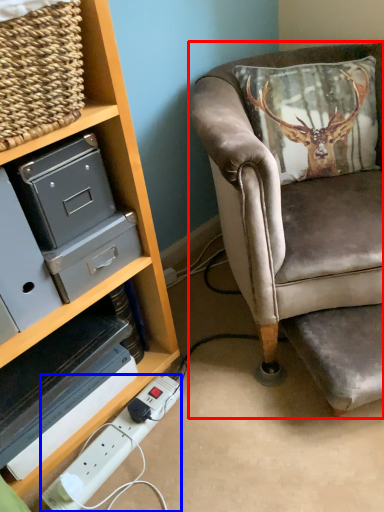
Question: Which of the following is the farthest to the observer, chair (highlighted by a red box) or extension cord (highlighted by a blue box)?

Choices:
 (A) chair
 (B) extension cord

Answer: (B)